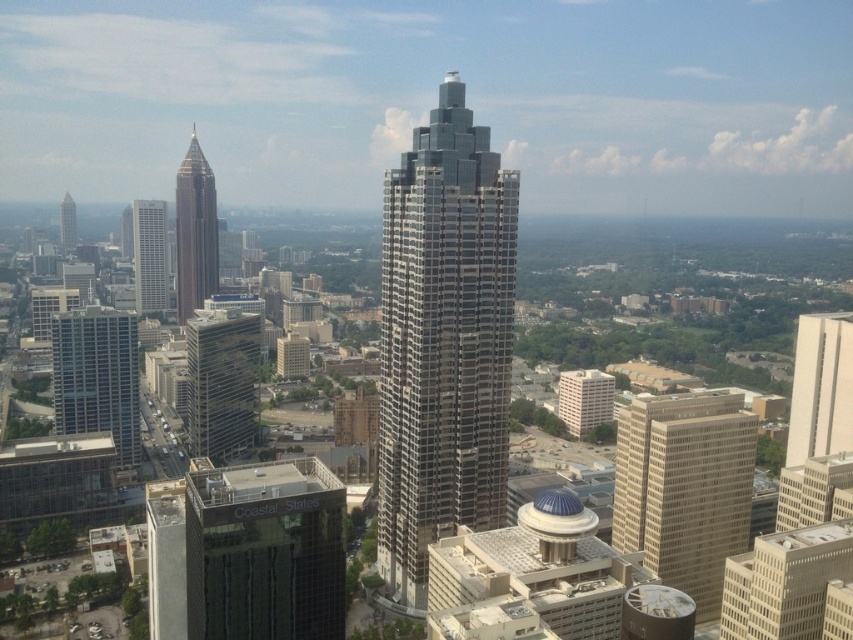
Is point (146, 260) positioned before point (560, 378)?

No, it is not.

Find the location of a particular element. This screenshot has width=853, height=640. gray glass skyscraper at center-left is located at coordinates (149, 256).

Does white concrete building at center-right have a lesser width compared to glassy reflective skyscraper at left?

Incorrect, white concrete building at center-right's width is not less than glassy reflective skyscraper at left's.

Is point (589, 390) in front of point (67, 225)?

Yes, point (589, 390) is closer to viewer.

Identify the location of white concrete building at center-right. The height and width of the screenshot is (640, 853). (584, 400).

Which of these two, glassy reflective building at left or gray glass skyscraper at center-left, stands shorter?

glassy reflective building at left

Is glassy reflective building at left positioned behind gray glass skyscraper at center-left?

No, glassy reflective building at left is closer to the viewer.

Where is `glassy reflective building at left`? This screenshot has width=853, height=640. glassy reflective building at left is located at coordinates (97, 376).

At what (x,y) coordinates should I click in order to perform the action: click on glassy reflective building at left. Please return your answer as a coordinate pair (x, y). Looking at the image, I should click on (97, 376).